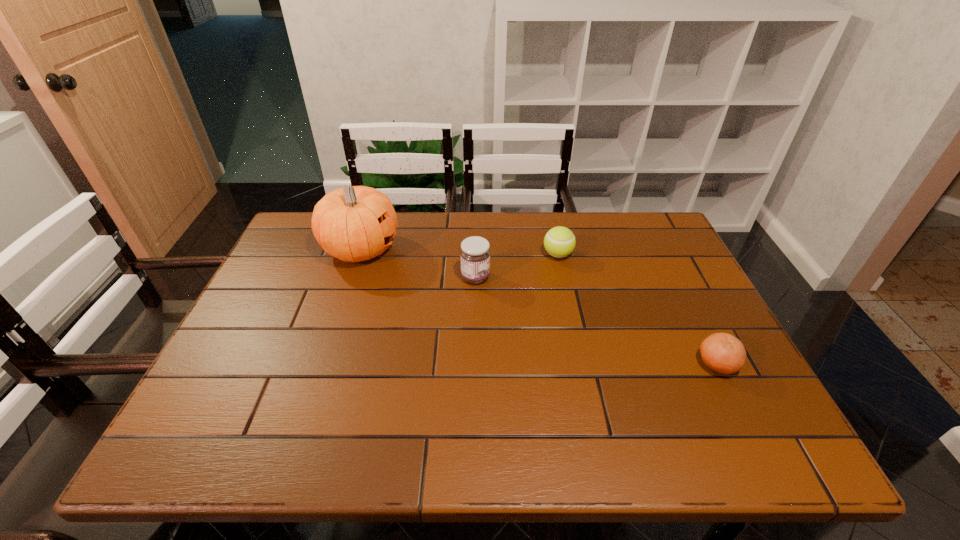
Locate an element on the screen. This screenshot has height=540, width=960. free space between the second object from right to left and the nearest object is located at coordinates (637, 309).

Identify the location of the third closest object to the pumpkin. The width and height of the screenshot is (960, 540). (723, 353).

What are the coordinates of `object that can be found as the third closest to the leftmost object` in the screenshot? It's located at (723, 353).

This screenshot has width=960, height=540. What are the coordinates of `free spot that satisfies the following two spatial constraints: 1. on the front-facing side of the leftmost object; 2. on the back side of the nearest object` in the screenshot? It's located at (323, 364).

Locate an element on the screen. The image size is (960, 540). blank area in the image that satisfies the following two spatial constraints: 1. on the front side of the third object from left to right; 2. on the front label of the jam is located at coordinates (563, 278).

The width and height of the screenshot is (960, 540). Identify the location of vacant region that satisfies the following two spatial constraints: 1. on the front-facing side of the rightmost object; 2. on the left side of the pumpkin. (323, 364).

This screenshot has width=960, height=540. I want to click on free spot that satisfies the following two spatial constraints: 1. on the front-facing side of the pumpkin; 2. on the right side of the rightmost object, so click(x=323, y=364).

The image size is (960, 540). What are the coordinates of `vacant position in the image that satisfies the following two spatial constraints: 1. on the front-facing side of the tallest object; 2. on the back side of the second shortest object` in the screenshot? It's located at (359, 254).

Identify the location of free location that satisfies the following two spatial constraints: 1. on the front-facing side of the leftmost object; 2. on the back side of the second object from right to left. This screenshot has height=540, width=960. (359, 254).

Where is `vacant area in the image that satisfies the following two spatial constraints: 1. on the front label of the rightmost object; 2. on the right side of the third shortest object`? vacant area in the image that satisfies the following two spatial constraints: 1. on the front label of the rightmost object; 2. on the right side of the third shortest object is located at coordinates (474, 364).